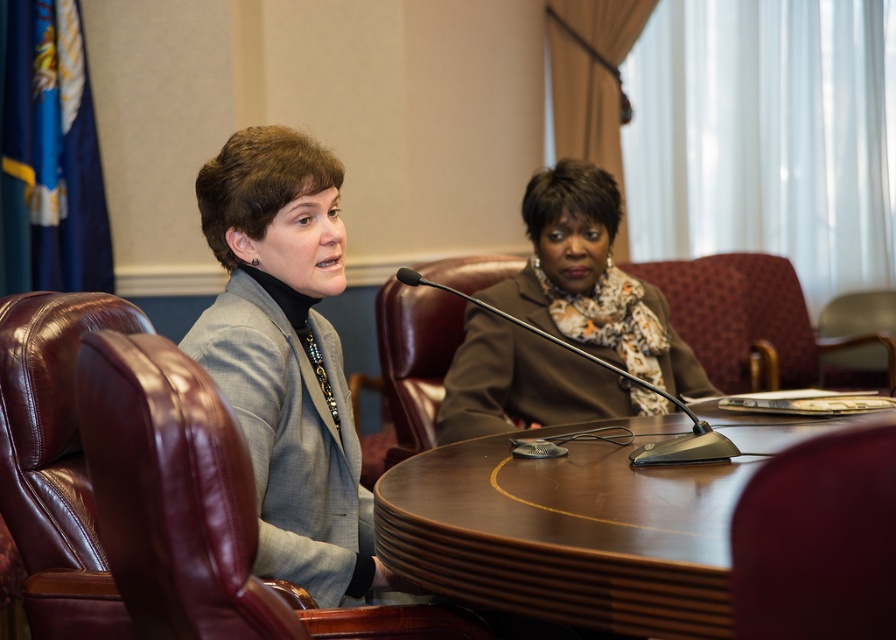
Image resolution: width=896 pixels, height=640 pixels. Describe the element at coordinates (287, 356) in the screenshot. I see `gray fabric jacket at center` at that location.

Does gray fabric jacket at center appear over black plastic microphone at center?

Incorrect, gray fabric jacket at center is not positioned above black plastic microphone at center.

Is point (341, 461) less distant than point (409, 268)?

Yes, point (341, 461) is in front of point (409, 268).

This screenshot has height=640, width=896. In order to click on gray fabric jacket at center in this screenshot , I will do `click(287, 356)`.

Image resolution: width=896 pixels, height=640 pixels. Describe the element at coordinates (789, 317) in the screenshot. I see `leather chair at center` at that location.

Does leather chair at center appear on the left side of black plastic microphone at center?

Incorrect, leather chair at center is not on the left side of black plastic microphone at center.

Locate an element on the screen. This screenshot has height=640, width=896. leather chair at center is located at coordinates (789, 317).

Is gray fabric jacket at center taller than brown leather chair at center?

Indeed, gray fabric jacket at center has a greater height compared to brown leather chair at center.

This screenshot has width=896, height=640. Find the location of `gray fabric jacket at center`. gray fabric jacket at center is located at coordinates (287, 356).